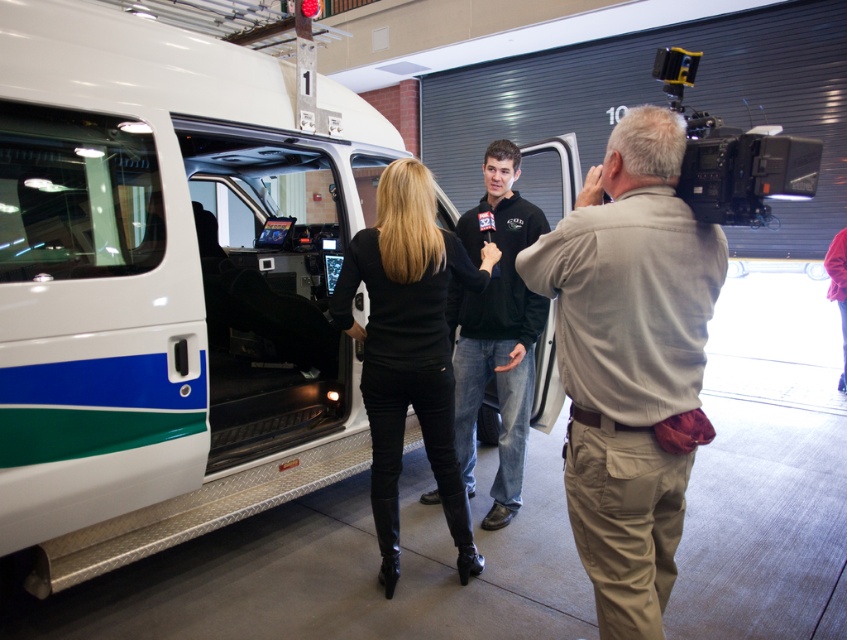
Question: Can you confirm if white glossy van at center is positioned above black fleece at center?

Choices:
 (A) no
 (B) yes

Answer: (B)

Question: Is white glossy van at center positioned before khaki cotton shirt at center?

Choices:
 (A) no
 (B) yes

Answer: (A)

Question: Which point appears closest to the camera in this image?

Choices:
 (A) (502, 426)
 (B) (401, 400)
 (C) (237, 472)

Answer: (B)

Question: Does khaki cotton shirt at center appear under black leather pants at center?

Choices:
 (A) no
 (B) yes

Answer: (A)

Question: Which of the following is the closest to the observer?

Choices:
 (A) (386, 288)
 (B) (601, 502)
 (C) (505, 273)

Answer: (B)

Question: Which of the following is the closest to the observer?

Choices:
 (A) black leather pants at center
 (B) white glossy van at center
 (C) black fleece at center
 (D) khaki cotton shirt at center

Answer: (D)